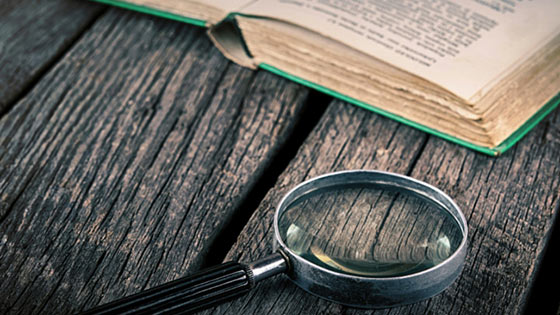
At what (x,y) coordinates should I click in order to perform the action: click on green edge of book covers. Please return your answer as a coordinate pair (x, y). Looking at the image, I should click on tap(474, 148), tap(162, 16).